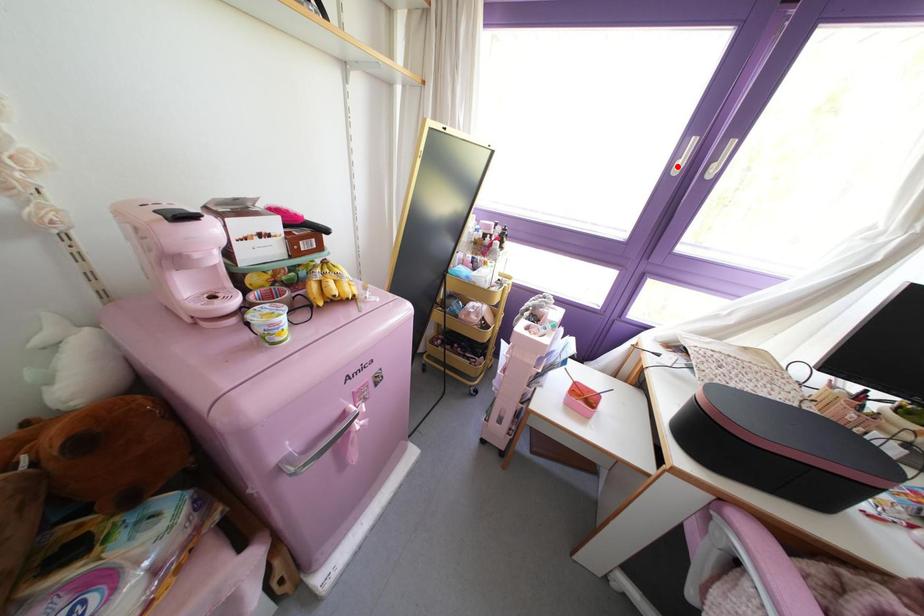
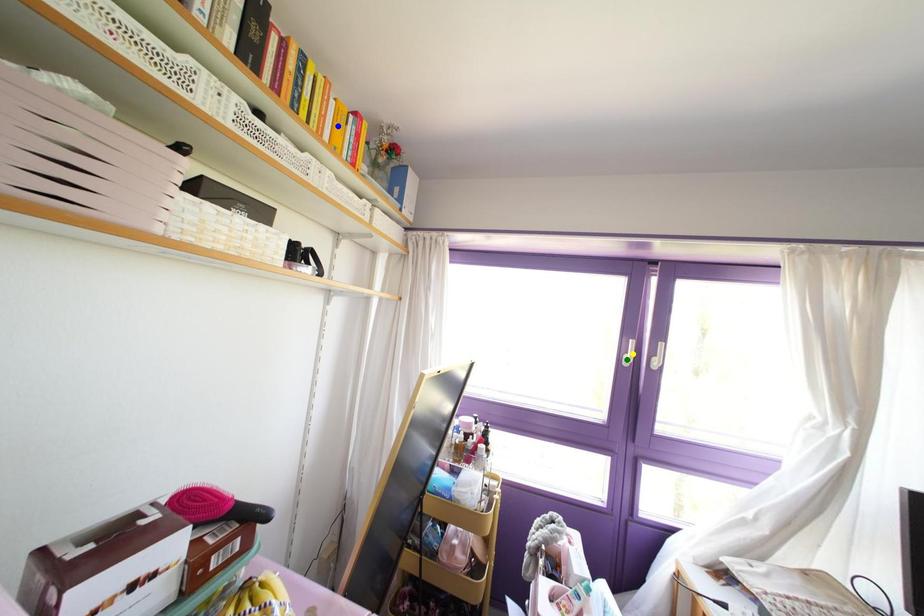
Question: I am providing you with two images of the same scene from different viewpoints. A red point is marked on the first image. You are given multiple points on the second image. Which point in image 2 represents the same 3d spot as the red point in image 1?

Choices:
 (A) yellow point
 (B) blue point
 (C) green point

Answer: (C)